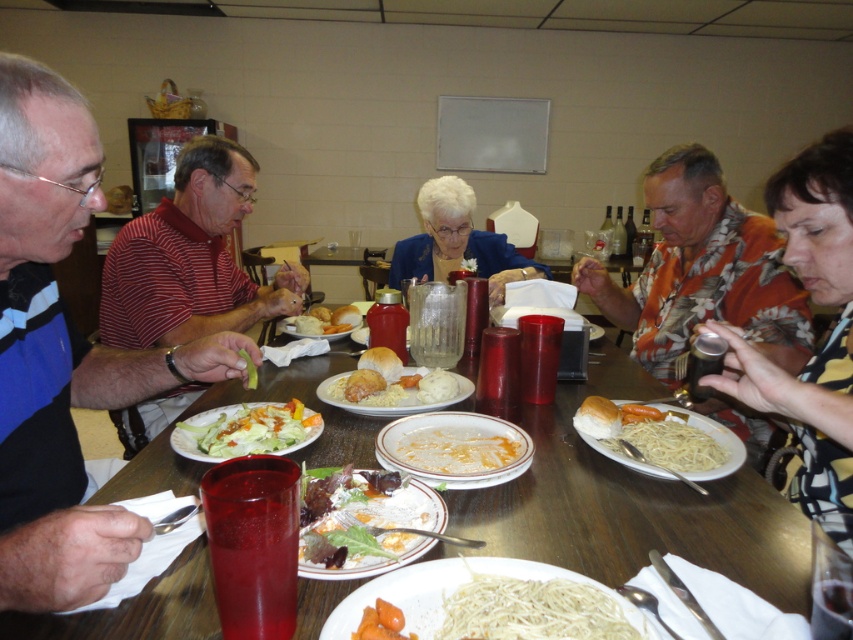
Is yellow striped shirt at right shorter than white matte noodles at center?

In fact, yellow striped shirt at right may be taller than white matte noodles at center.

Can you confirm if yellow striped shirt at right is wider than white matte noodles at center?

Yes.

What do you see at coordinates (816, 349) in the screenshot?
I see `yellow striped shirt at right` at bounding box center [816, 349].

Identify the location of yellow striped shirt at right. (816, 349).

Is point (461, 433) positioned in front of point (666, 422)?

Yes, it is in front of point (666, 422).

Between point (460, 432) and point (682, 454), which one is positioned behind?

Positioned behind is point (460, 432).

The width and height of the screenshot is (853, 640). What do you see at coordinates (456, 449) in the screenshot?
I see `white matte plate at center` at bounding box center [456, 449].

This screenshot has height=640, width=853. Identify the location of white matte plate at center. 456,449.

Is wooden table at center taller than yellow striped shirt at right?

In fact, wooden table at center may be shorter than yellow striped shirt at right.

Which is behind, point (538, 483) or point (720, 332)?

Point (538, 483)

Where is `wooden table at center`? This screenshot has height=640, width=853. wooden table at center is located at coordinates (631, 506).